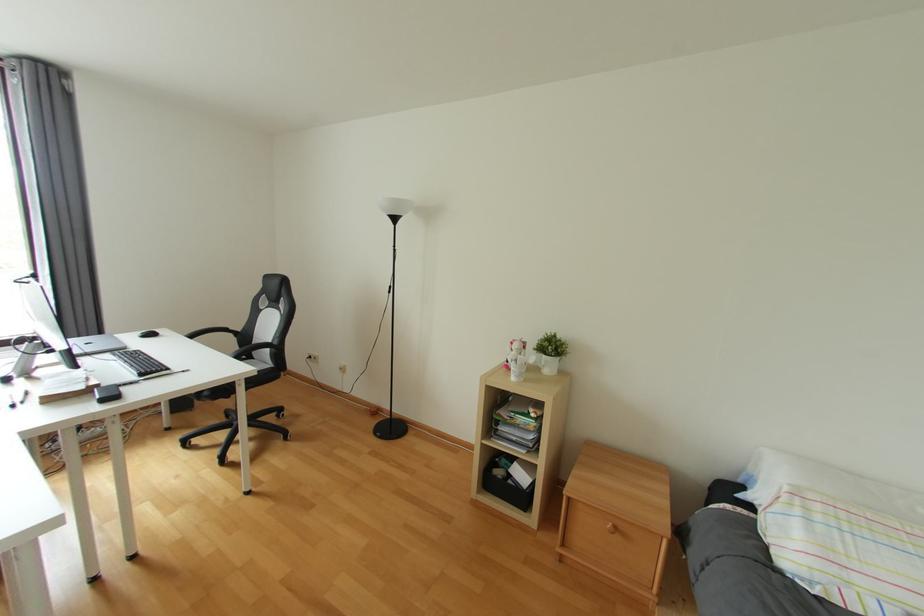
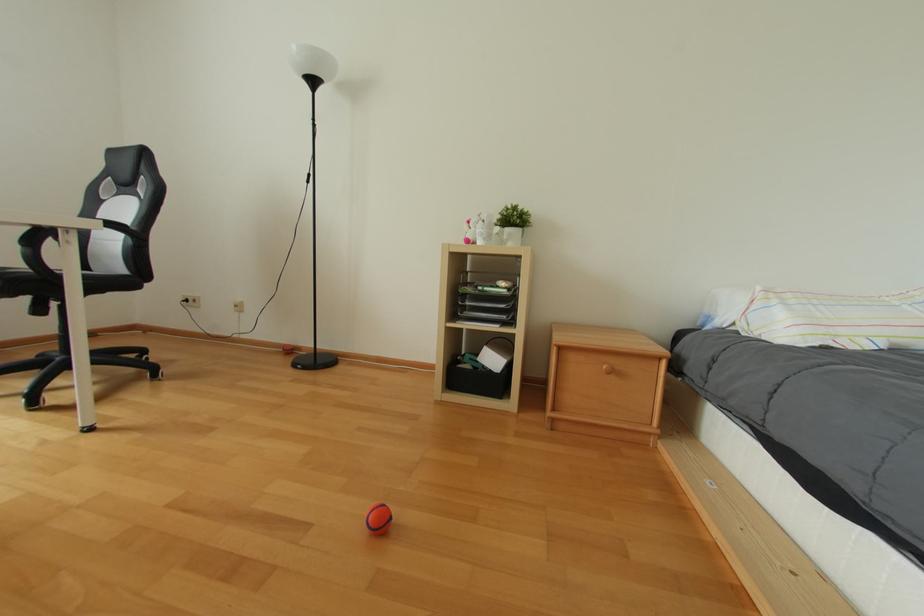
What movement of the cameraman would produce the second image?

The cameraman moved toward left, forward.